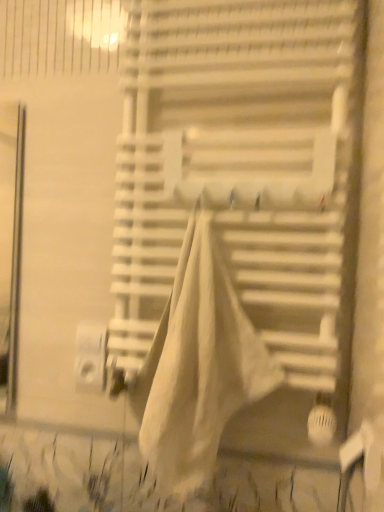
Question: Is white plastic window blind at center bigger or smaller than white cotton blanket at center?

Choices:
 (A) big
 (B) small

Answer: (A)

Question: Considering the positions of white plastic window blind at center and white cotton blanket at center in the image, is white plastic window blind at center wider or thinner than white cotton blanket at center?

Choices:
 (A) thin
 (B) wide

Answer: (A)

Question: Would you say white plastic window blind at center is to the left or to the right of white cotton blanket at center in the picture?

Choices:
 (A) right
 (B) left

Answer: (A)

Question: Is white cotton blanket at center in front of or behind white plastic window blind at center in the image?

Choices:
 (A) front
 (B) behind

Answer: (A)

Question: From the image's perspective, is white cotton blanket at center above or below white plastic window blind at center?

Choices:
 (A) below
 (B) above

Answer: (A)

Question: Is white cotton blanket at center situated inside white plastic window blind at center or outside?

Choices:
 (A) outside
 (B) inside

Answer: (B)

Question: Based on their sizes in the image, would you say white cotton blanket at center is bigger or smaller than white plastic window blind at center?

Choices:
 (A) small
 (B) big

Answer: (A)